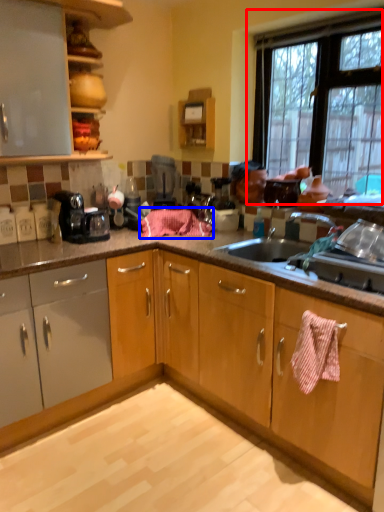
Question: Which object is closer to the camera taking this photo, window (highlighted by a red box) or blanket (highlighted by a blue box)?

Choices:
 (A) window
 (B) blanket

Answer: (A)